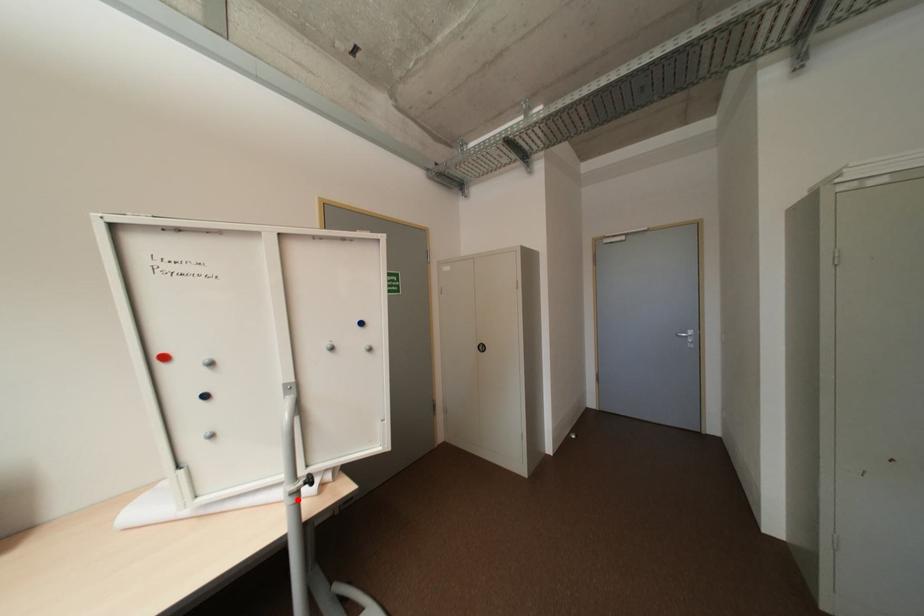
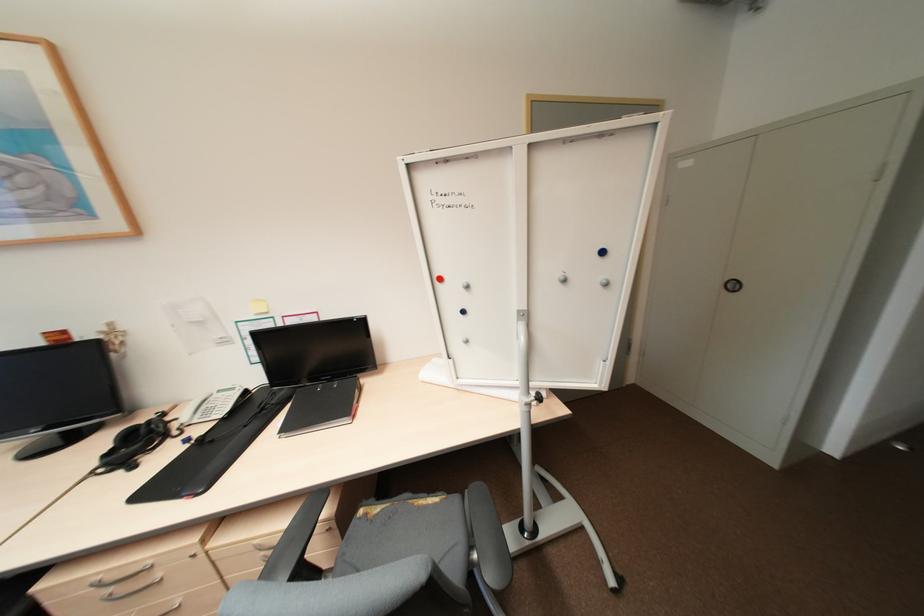
In the second image, find the point that corresponds to the highlighted location in the first image.

(531, 408)